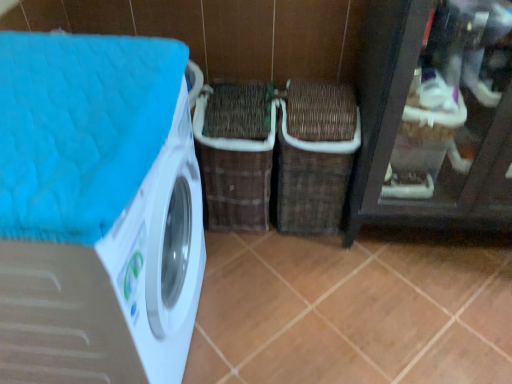
Locate an element on the screen. woven brown basket at center, positioned as the 1th basket in right-to-left order is located at coordinates (313, 179).

From the picture: What is the approximate height of white glossy washing machine at left?

1.04 meters.

Identify the location of brown woven basket at center, placed as the first basket when sorted from left to right. The image size is (512, 384). (234, 154).

Is brown woven basket at center, placed as the first basket when sorted from left to right, oriented towards white glossy washing machine at left?

No, brown woven basket at center, placed as the first basket when sorted from left to right, is not aimed at white glossy washing machine at left.

Does point (239, 162) come farther from viewer compared to point (145, 180)?

That is True.

Looking at this image, is brown woven basket at center, placed as the first basket when sorted from left to right, smaller than white glossy washing machine at left?

Yes.

Is the surface of brown matte tile at center in direct contact with brown woven basket at center, placed as the second basket when sorted from right to left?

brown matte tile at center and brown woven basket at center, placed as the second basket when sorted from right to left, are not in contact.

From a real-world perspective, who is located lower, brown matte tile at center or brown woven basket at center, placed as the first basket when sorted from left to right?

From a 3D spatial view, brown matte tile at center is below.

Where is `tile that appears below the brown woven basket at center, placed as the first basket when sorted from left to right (from the image's perspective)`? Image resolution: width=512 pixels, height=384 pixels. tile that appears below the brown woven basket at center, placed as the first basket when sorted from left to right (from the image's perspective) is located at coordinates (353, 310).

Is brown matte tile at center positioned beyond the bounds of brown woven basket at center, placed as the second basket when sorted from right to left?

brown matte tile at center is positioned outside brown woven basket at center, placed as the second basket when sorted from right to left.

Between white glossy washing machine at left and brown matte tile at center, which one is positioned in front?

Positioned in front is white glossy washing machine at left.

From a real-world perspective, is white glossy washing machine at left physically above brown matte tile at center?

Yes, from a real-world perspective, white glossy washing machine at left is above brown matte tile at center.

Is white glossy washing machine at left placed right next to brown matte tile at center?

white glossy washing machine at left and brown matte tile at center are not in contact.

In terms of size, does white glossy washing machine at left appear bigger or smaller than brown matte tile at center?

Clearly, white glossy washing machine at left is larger in size than brown matte tile at center.

From a real-world perspective, is white glossy washing machine at left located higher than woven brown basket at center, which is counted as the 2th basket, starting from the left?

Indeed, from a real-world perspective, white glossy washing machine at left stands above woven brown basket at center, which is counted as the 2th basket, starting from the left.

Considering the sizes of objects white glossy washing machine at left and woven brown basket at center, positioned as the 1th basket in right-to-left order, in the image provided, who is bigger, white glossy washing machine at left or woven brown basket at center, positioned as the 1th basket in right-to-left order,?

With larger size is white glossy washing machine at left.

Would you consider white glossy washing machine at left to be distant from woven brown basket at center, which is counted as the 2th basket, starting from the left?

No, there isn't a large distance between white glossy washing machine at left and woven brown basket at center, which is counted as the 2th basket, starting from the left.

Based on the photo, how different are the orientations of white glossy washing machine at left and woven brown basket at center, which is counted as the 2th basket, starting from the left, in degrees?

white glossy washing machine at left and woven brown basket at center, which is counted as the 2th basket, starting from the left, are facing 89.5 degrees away from each other.

Are brown matte tile at center and white glossy washing machine at left beside each other?

No, brown matte tile at center is not in contact with white glossy washing machine at left.

Looking at this image, from a real-world perspective, relative to white glossy washing machine at left, is brown matte tile at center vertically above or below?

brown matte tile at center is situated lower than white glossy washing machine at left in the real world.

From the image's perspective, is brown matte tile at center beneath white glossy washing machine at left?

Indeed, from the image's perspective, brown matte tile at center is shown beneath white glossy washing machine at left.

Find the location of a particular element. The width and height of the screenshot is (512, 384). washing machine in front of the brown matte tile at center is located at coordinates (x=112, y=285).

Considering the points (177, 191) and (243, 95), which point is behind, point (177, 191) or point (243, 95)?

Point (243, 95)

From a real-world perspective, which is physically above, white glossy washing machine at left or brown woven basket at center, placed as the first basket when sorted from left to right?

white glossy washing machine at left is physically above.

Considering the sizes of objects white glossy washing machine at left and brown woven basket at center, placed as the second basket when sorted from right to left, in the image provided, who is taller, white glossy washing machine at left or brown woven basket at center, placed as the second basket when sorted from right to left,?

Standing taller between the two is white glossy washing machine at left.

In terms of width, does white glossy washing machine at left look wider or thinner when compared to brown woven basket at center, placed as the first basket when sorted from left to right?

Clearly, white glossy washing machine at left has more width compared to brown woven basket at center, placed as the first basket when sorted from left to right.

Which is more to the right, woven brown basket at center, which is counted as the 2th basket, starting from the left, or white glossy washing machine at left?

woven brown basket at center, which is counted as the 2th basket, starting from the left, is more to the right.

Is woven brown basket at center, which is counted as the 2th basket, starting from the left, beside white glossy washing machine at left?

woven brown basket at center, which is counted as the 2th basket, starting from the left, is not next to white glossy washing machine at left, and they're not touching.

Does point (316, 185) lie behind point (0, 272)?

Yes, it is behind point (0, 272).

Identify the location of washing machine below the brown woven basket at center, placed as the second basket when sorted from right to left (from the image's perspective). This screenshot has height=384, width=512. (112, 285).

You are a GUI agent. You are given a task and a screenshot of the screen. Output one action in this format:
    pyautogui.click(x=<x>, y=<y>)
    Task: Click on the 1st basket positioned above the brown matte tile at center (from a real-world perspective)
    The height and width of the screenshot is (384, 512).
    Given the screenshot: What is the action you would take?
    pyautogui.click(x=234, y=154)

When comparing their distances from brown matte tile at center, does brown woven basket at center, placed as the first basket when sorted from left to right, or white glossy washing machine at left seem closer?

brown woven basket at center, placed as the first basket when sorted from left to right, is positioned closer to the anchor brown matte tile at center.

Considering their positions, is brown matte tile at center positioned further to white glossy washing machine at left than brown woven basket at center, placed as the first basket when sorted from left to right?

Among the two, brown matte tile at center is located further to white glossy washing machine at left.

When comparing their distances from brown matte tile at center, does white glossy washing machine at left or brown woven basket at center, placed as the first basket when sorted from left to right, seem closer?

Among the two, brown woven basket at center, placed as the first basket when sorted from left to right, is located nearer to brown matte tile at center.

From the image, which object appears to be farther from woven brown basket at center, positioned as the 1th basket in right-to-left order, white glossy washing machine at left or brown woven basket at center, placed as the first basket when sorted from left to right?

white glossy washing machine at left is positioned further to the anchor woven brown basket at center, positioned as the 1th basket in right-to-left order.

Based on their spatial positions, is brown woven basket at center, placed as the second basket when sorted from right to left, or woven brown basket at center, positioned as the 1th basket in right-to-left order, closer to white glossy washing machine at left?

The object closer to white glossy washing machine at left is brown woven basket at center, placed as the second basket when sorted from right to left.

Considering their positions, is woven brown basket at center, which is counted as the 2th basket, starting from the left, positioned further to brown woven basket at center, placed as the first basket when sorted from left to right, than brown matte tile at center?

brown matte tile at center is further to brown woven basket at center, placed as the first basket when sorted from left to right.

Estimate the real-world distances between objects in this image. Which object is closer to brown woven basket at center, placed as the second basket when sorted from right to left, brown matte tile at center or woven brown basket at center, which is counted as the 2th basket, starting from the left?

woven brown basket at center, which is counted as the 2th basket, starting from the left, is positioned closer to the anchor brown woven basket at center, placed as the second basket when sorted from right to left.

From the image, which object appears to be farther from brown matte tile at center, woven brown basket at center, which is counted as the 2th basket, starting from the left, or brown woven basket at center, placed as the first basket when sorted from left to right?

The object further to brown matte tile at center is brown woven basket at center, placed as the first basket when sorted from left to right.

You are a GUI agent. You are given a task and a screenshot of the screen. Output one action in this format:
    pyautogui.click(x=<x>, y=<y>)
    Task: Click on the basket between white glossy washing machine at left and brown woven basket at center, placed as the second basket when sorted from right to left, along the z-axis
    
    Given the screenshot: What is the action you would take?
    pyautogui.click(x=313, y=179)

Where is `tile located between white glossy washing machine at left and brown woven basket at center, placed as the first basket when sorted from left to right, in the depth direction`? The height and width of the screenshot is (384, 512). tile located between white glossy washing machine at left and brown woven basket at center, placed as the first basket when sorted from left to right, in the depth direction is located at coordinates (353, 310).

The height and width of the screenshot is (384, 512). I want to click on tile located between white glossy washing machine at left and woven brown basket at center, which is counted as the 2th basket, starting from the left, in the depth direction, so click(x=353, y=310).

Locate an element on the screen. Image resolution: width=512 pixels, height=384 pixels. basket between brown woven basket at center, placed as the first basket when sorted from left to right, and brown matte tile at center from top to bottom is located at coordinates (313, 179).